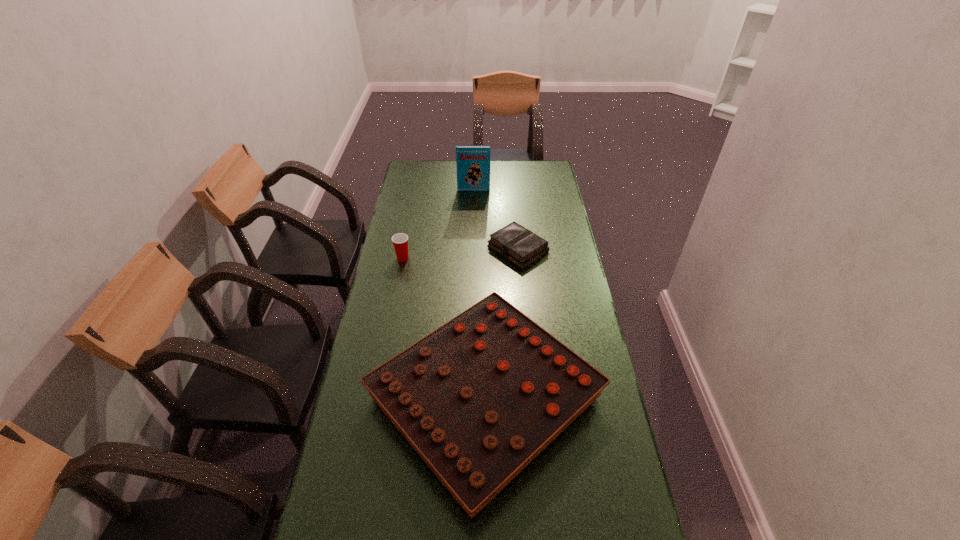
Where is `Dixie cup positioned at the left edge`? Image resolution: width=960 pixels, height=540 pixels. Dixie cup positioned at the left edge is located at coordinates (400, 241).

This screenshot has width=960, height=540. Find the location of `gameboard present at the left edge`. gameboard present at the left edge is located at coordinates (479, 398).

This screenshot has height=540, width=960. Find the location of `gameboard that is at the right edge`. gameboard that is at the right edge is located at coordinates (479, 398).

Locate an element on the screen. book present at the right edge is located at coordinates (514, 242).

This screenshot has width=960, height=540. What are the coordinates of `free space at the left edge` in the screenshot? It's located at (383, 263).

At what (x,y) coordinates should I click in order to perform the action: click on free location at the right edge of the desktop. Please return your answer as a coordinate pair (x, y). Image resolution: width=960 pixels, height=540 pixels. Looking at the image, I should click on (559, 186).

Find the location of a particular element. The image size is (960, 540). vacant space in between the Dixie cup and the farthest object is located at coordinates (439, 224).

At what (x,y) coordinates should I click in order to perform the action: click on unoccupied position between the nearest object and the farthest object. Please return your answer as a coordinate pair (x, y). Looking at the image, I should click on (479, 294).

This screenshot has height=540, width=960. I want to click on vacant region between the Dixie cup and the nearer book, so pyautogui.click(x=461, y=253).

Image resolution: width=960 pixels, height=540 pixels. Find the location of `unoccupied area between the farthest object and the gameboard`. unoccupied area between the farthest object and the gameboard is located at coordinates (479, 294).